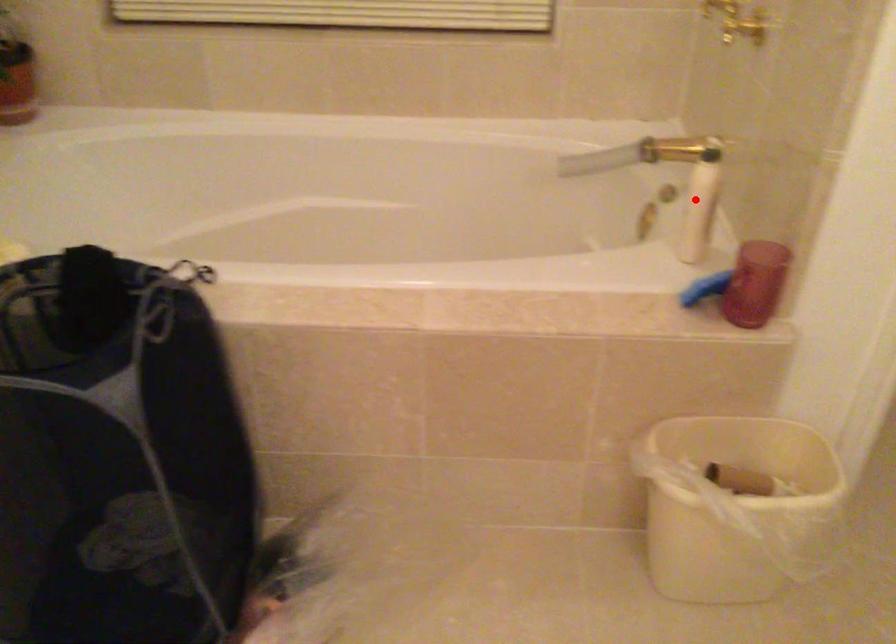
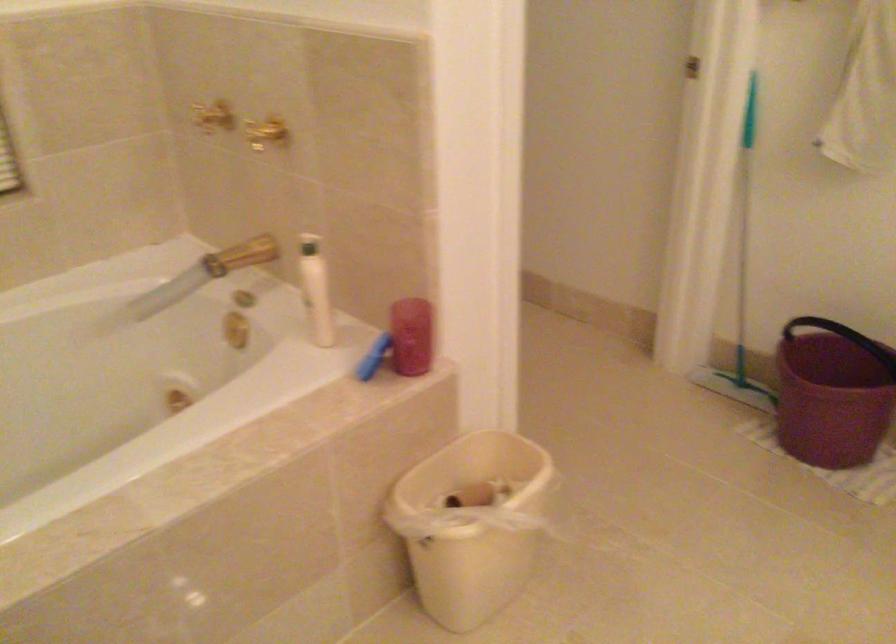
In the second image, find the point that corresponds to the highlighted location in the first image.

(315, 289)